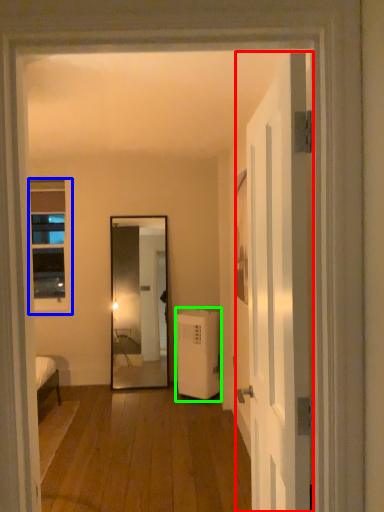
Question: Based on their relative distances, which object is nearer to door (highlighted by a red box)? Choose from window (highlighted by a blue box) and air conditioner (highlighted by a green box).

Choices:
 (A) window
 (B) air conditioner

Answer: (B)